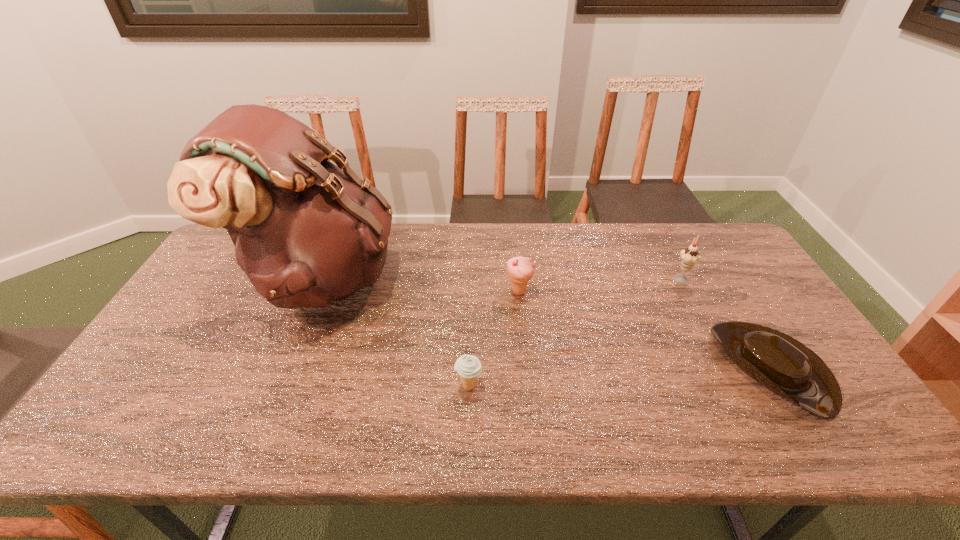
Identify the location of the tallest object. The height and width of the screenshot is (540, 960). (306, 232).

You are a GUI agent. You are given a task and a screenshot of the screen. Output one action in this format:
    pyautogui.click(x=<x>, y=<y>)
    Task: Click on the leftmost object
    
    Given the screenshot: What is the action you would take?
    (x=306, y=232)

This screenshot has height=540, width=960. In order to click on the rightmost icecream in this screenshot , I will do [689, 256].

Where is `the second icecream from right to left`? Image resolution: width=960 pixels, height=540 pixels. the second icecream from right to left is located at coordinates (520, 270).

Find the location of a particular element. the fourth tallest object is located at coordinates (468, 367).

At what (x,y) coordinates should I click in order to perform the action: click on the shortest icecream. Please return your answer as a coordinate pair (x, y). The image size is (960, 540). Looking at the image, I should click on (468, 367).

What are the coordinates of `cowboy hat` in the screenshot? It's located at (785, 366).

Where is `free space located 0.220m at the front of the tallest object with buckles`? The height and width of the screenshot is (540, 960). free space located 0.220m at the front of the tallest object with buckles is located at coordinates (467, 276).

The height and width of the screenshot is (540, 960). What are the coordinates of `vacant area situated 0.310m on the left of the rightmost icecream` in the screenshot? It's located at (571, 278).

At what (x,y) coordinates should I click in order to perform the action: click on free space located on the front of the second icecream from right to left. Please return your answer as a coordinate pair (x, y). Looking at the image, I should click on pos(524,346).